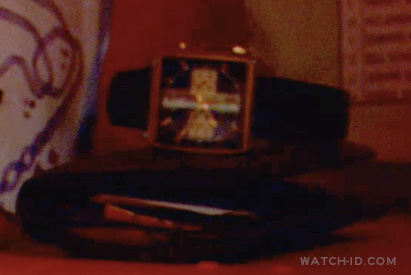
What are the coordinates of `clock` in the screenshot? It's located at (200, 111).